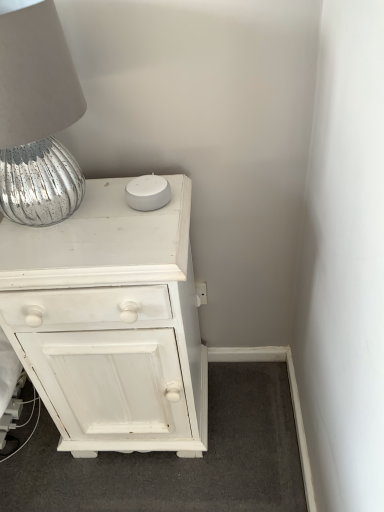
Locate an element on the screen. vacant space underneath silver textured lampshade at upper left (from a real-world perspective) is located at coordinates (52, 216).